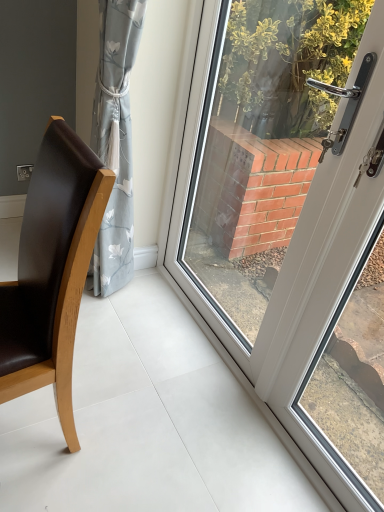
Locate an element on the screen. The width and height of the screenshot is (384, 512). free spot in front of white glossy door at center is located at coordinates (202, 441).